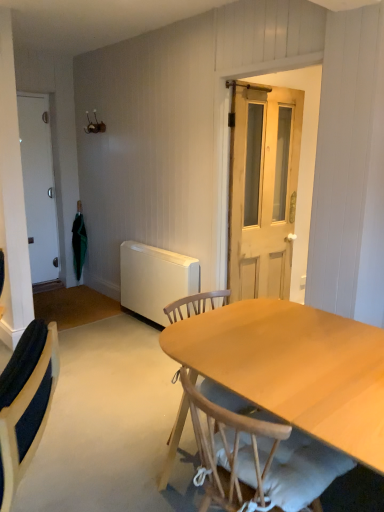
At what (x,y) coordinates should I click in order to perform the action: click on free space above white matte radiator at lower left (from a real-world perspective). Please return your answer as a coordinate pair (x, y). Looking at the image, I should click on (159, 249).